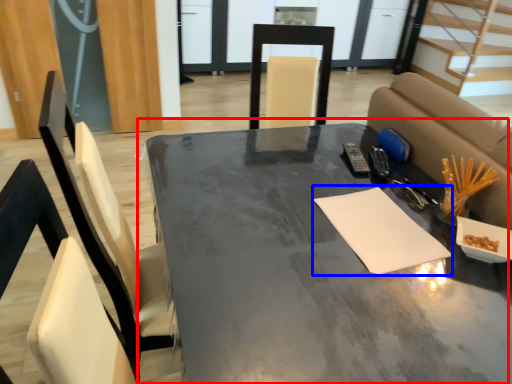
Question: Which object is further to the camera taking this photo, table (highlighted by a red box) or notepad (highlighted by a blue box)?

Choices:
 (A) table
 (B) notepad

Answer: (B)